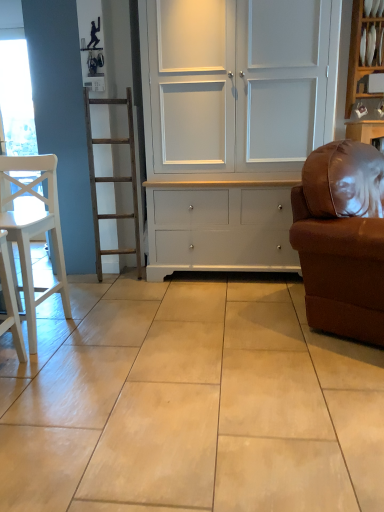
Question: Considering the positions of white matte chair at left and brown leather couch at right in the image, is white matte chair at left taller or shorter than brown leather couch at right?

Choices:
 (A) short
 (B) tall

Answer: (A)

Question: Based on their positions, is white matte chair at left located to the left or right of brown leather couch at right?

Choices:
 (A) right
 (B) left

Answer: (B)

Question: Which object is positioned closest to the white glossy shelf at upper right?

Choices:
 (A) white matte chair at left
 (B) white painted wood cupboard at center
 (C) brown leather couch at right

Answer: (B)

Question: Which of these objects is positioned farthest from the white painted wood cupboard at center?

Choices:
 (A) white matte chair at left
 (B) brown leather couch at right
 (C) white glossy shelf at upper right

Answer: (C)